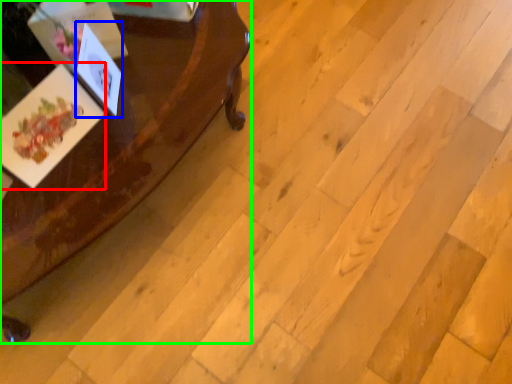
Question: Which is farther away from postcard (highlighted by a red box)? postcard (highlighted by a blue box) or table (highlighted by a green box)?

Choices:
 (A) postcard
 (B) table

Answer: (B)